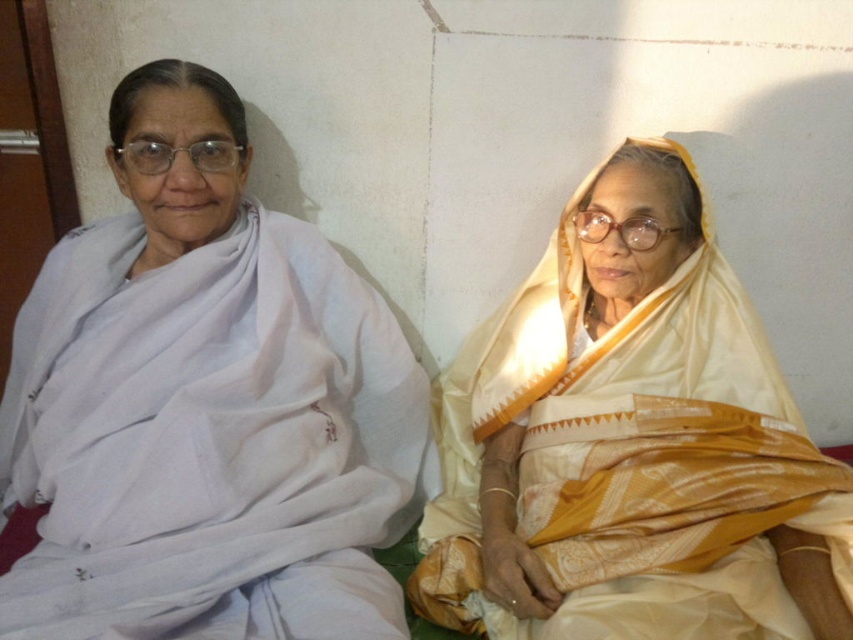
You are a fashion designer observing two women in saris. The first is wearing a white cotton sari at left, and the second is wearing a silky yellow sari at right. Which sari has a greater width?

The white cotton sari at left has a greater width than the silky yellow sari at right.

In the scene shown: You are standing at the point labeled point [231,600] and want to take a photo of the two elderly women sitting against the white wall. The camera you have can focus on objects within 1.5 meters. Will the camera be able to focus on the women?

The point labeled point [231,600] and the camera are 1.23 meters apart. Since the camera can focus within 1.5 meters, the distance is within range. Therefore, the camera can focus on the women.

You are a fashion designer observing two women in saris. You need to determine which sari has a longer length based on their positions. Which sari, the white cotton sari at left or the silky yellow sari at right, is taller?

The white cotton sari at left is taller than the silky yellow sari at right according to the description provided.